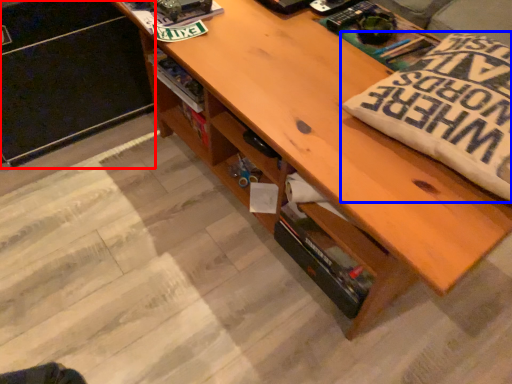
Question: Which object is closer to the camera taking this photo, file cabinet (highlighted by a red box) or throw pillow (highlighted by a blue box)?

Choices:
 (A) file cabinet
 (B) throw pillow

Answer: (B)